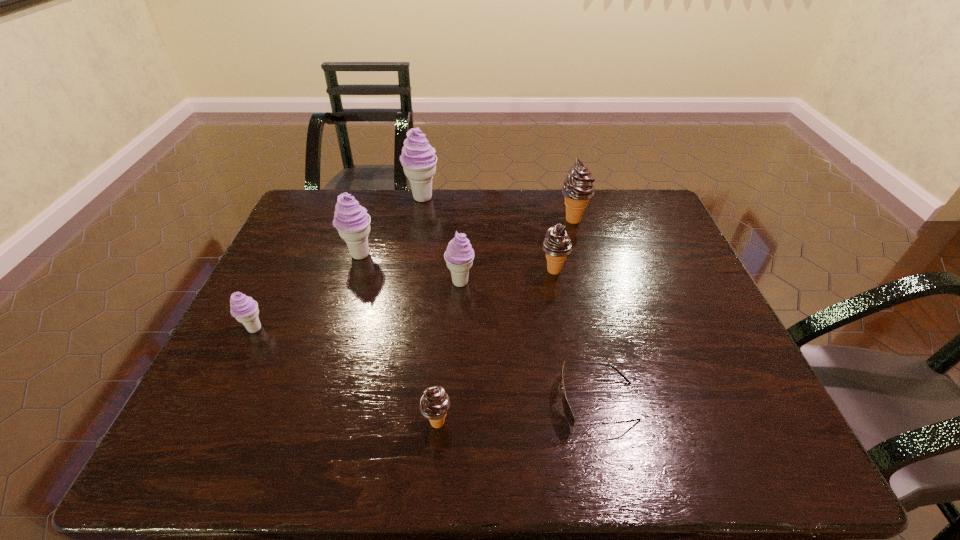
Find the location of a particular element. The height and width of the screenshot is (540, 960). free space located 0.280m on the front of the leftmost purple icecream is located at coordinates (195, 452).

Image resolution: width=960 pixels, height=540 pixels. In order to click on free space located 0.310m on the back of the nearest icecream in this screenshot , I will do `click(446, 302)`.

Image resolution: width=960 pixels, height=540 pixels. In order to click on vacant position located 0.390m on the front-facing side of the shortest object in this screenshot , I will do `click(375, 401)`.

At what (x,y) coordinates should I click in order to perform the action: click on free space located on the front-facing side of the shortest object. Please return your answer as a coordinate pair (x, y). Looking at the image, I should click on (507, 401).

Locate an element on the screen. vacant area situated on the front-facing side of the shortest object is located at coordinates (437, 401).

Locate an element on the screen. icecream present at the near edge is located at coordinates (434, 404).

This screenshot has width=960, height=540. I want to click on sunglasses at the near edge, so click(568, 413).

The width and height of the screenshot is (960, 540). Find the location of `object that is positioned at the left edge`. object that is positioned at the left edge is located at coordinates (245, 310).

At what (x,y) coordinates should I click in order to perform the action: click on vacant space at the far edge of the desktop. Please return your answer as a coordinate pair (x, y). Looking at the image, I should click on (445, 194).

You are a GUI agent. You are given a task and a screenshot of the screen. Output one action in this format:
    pyautogui.click(x=<x>, y=<y>)
    Task: Click on the free space at the near edge
    The width and height of the screenshot is (960, 540).
    Given the screenshot: What is the action you would take?
    pyautogui.click(x=387, y=444)